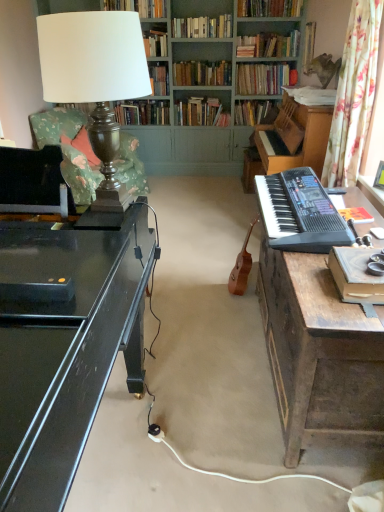
Question: In terms of width, does hardcover book at upper right, acting as the second book starting from the front, look wider or thinner when compared to hardcover book at center, the seventh book in the front-to-back sequence?

Choices:
 (A) wide
 (B) thin

Answer: (B)

Question: Considering the positions of hardcover book at upper right, the 11th book when ordered from back to front, and hardcover book at center, the seventh book in the front-to-back sequence, in the image, is hardcover book at upper right, the 11th book when ordered from back to front, taller or shorter than hardcover book at center, the seventh book in the front-to-back sequence,?

Choices:
 (A) tall
 (B) short

Answer: (B)

Question: Considering the real-world distances, which object is closest to the wooden book at right, the first book positioned from the front?

Choices:
 (A) floral fabric curtain at right
 (B) hardcover book at upper center, marked as the 10th book in a back-to-front arrangement
 (C) hardcover book at upper center, the 5th book in the front-to-back sequence
 (D) wooden desk at right
 (E) hardcover book at center, arranged as the first book when viewed from the back

Answer: (D)

Question: Estimate the real-world distances between objects in this image. Which object is farther from the wooden desk at right?

Choices:
 (A) hardcover book at upper right, acting as the second book starting from the front
 (B) hardcover book at center, which is the 6th book from back to front
 (C) hardcover books at center, the 11th book in the front-to-back sequence
 (D) floral fabric curtain at right
 (E) black glossy desk at left

Answer: (C)